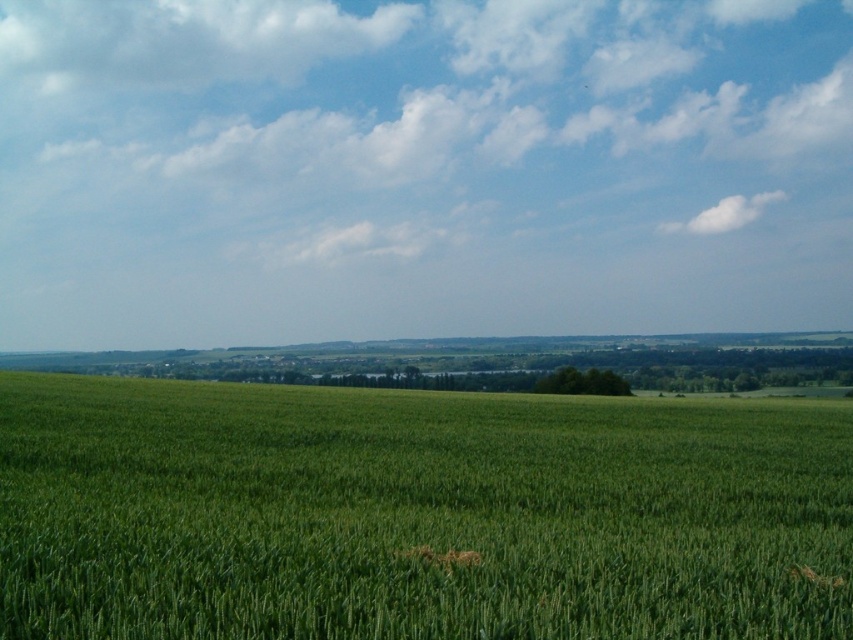
You are standing in the middle of the green grassy field at center and looking towards the horizon. Which direction should you walk to reach the white fluffy cloud at upper center?

You cannot reach the white fluffy cloud at upper center because it is located in the sky above the green grassy field at center, so it is not accessible on the ground.

You are standing in the middle of the field and see the point marked at coordinates (184, 38). What is located at that point?

The point at coordinates (184, 38) marks the location of the white fluffy cloud at upper center.